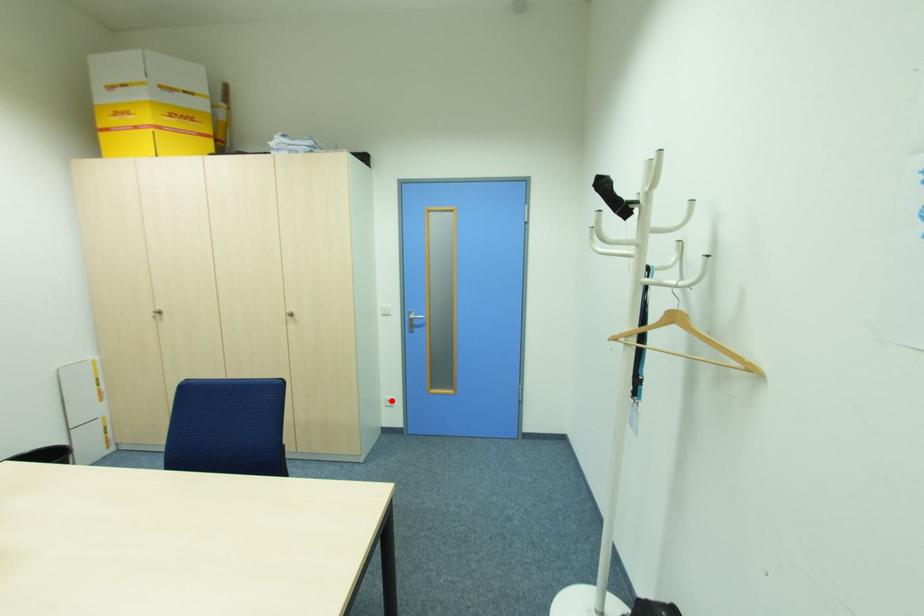
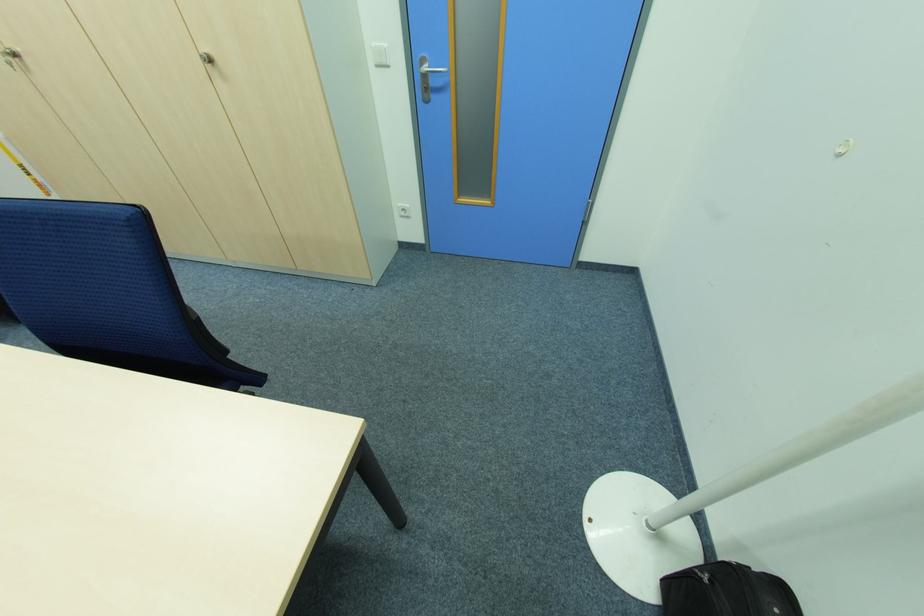
Question: I am providing you with two images of the same scene from different viewpoints. A red point is shown in image1. For the corresponding object point in image2, is it positioned nearer or farther from the camera?

Choices:
 (A) Nearer
 (B) Farther

Answer: (A)